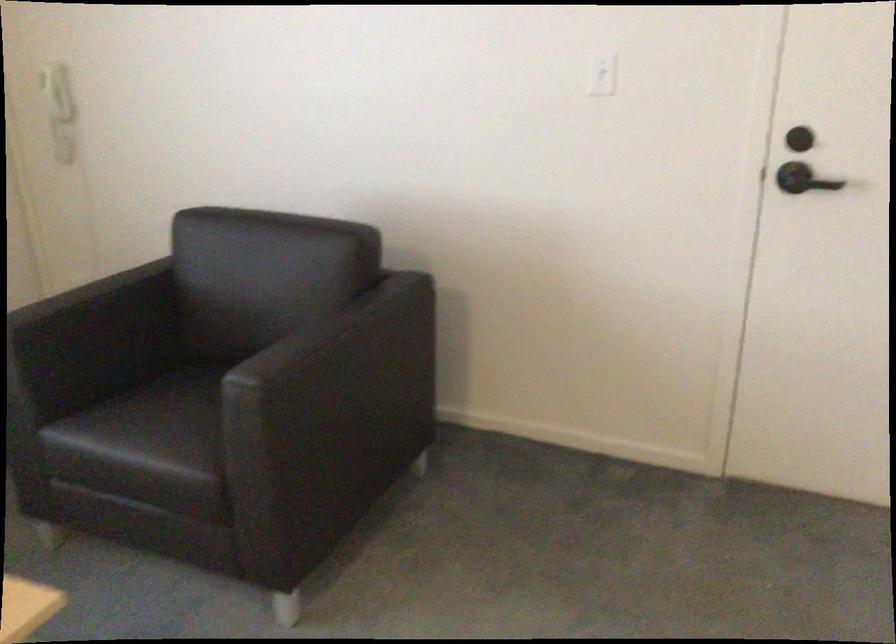
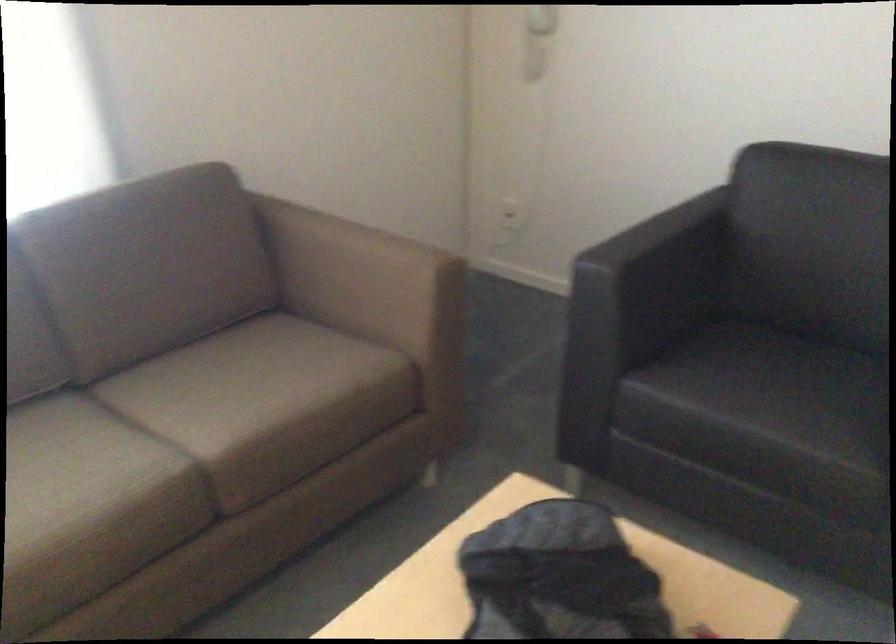
Where in the second image is the point corresponding to point 74,330 from the first image?

(652, 270)